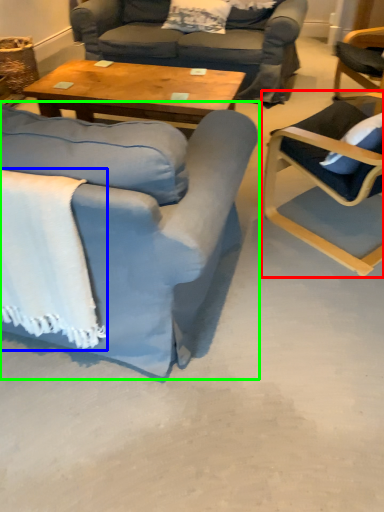
Question: Estimate the real-world distances between objects in this image. Which object is farther from chair (highlighted by a red box), blanket (highlighted by a blue box) or chair (highlighted by a green box)?

Choices:
 (A) blanket
 (B) chair

Answer: (A)